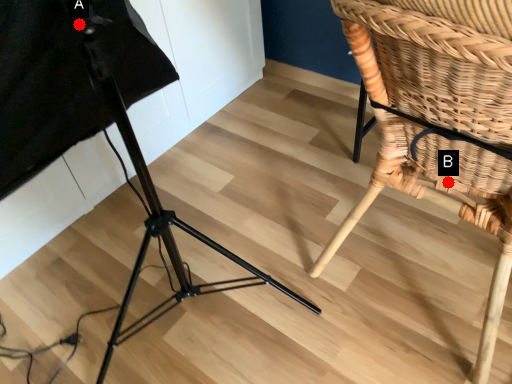
Question: Two points are circled on the image, labeled by A and B beside each circle. Which of the following is the closest to the observer?

Choices:
 (A) A is closer
 (B) B is closer

Answer: (A)